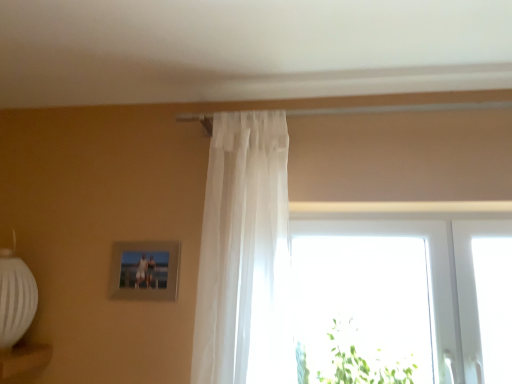
Question: Is sheer white curtain at center a part of metallic silver picture frame at upper left?

Choices:
 (A) yes
 (B) no

Answer: (B)

Question: Is metallic silver picture frame at upper left next to sheer white curtain at center?

Choices:
 (A) no
 (B) yes

Answer: (A)

Question: Does metallic silver picture frame at upper left appear on the left side of sheer white curtain at center?

Choices:
 (A) yes
 (B) no

Answer: (A)

Question: From the image's perspective, is metallic silver picture frame at upper left located beneath sheer white curtain at center?

Choices:
 (A) no
 (B) yes

Answer: (B)

Question: From the image's perspective, is metallic silver picture frame at upper left over sheer white curtain at center?

Choices:
 (A) no
 (B) yes

Answer: (A)

Question: Is transparent glass window at center taller or shorter than metallic silver picture frame at upper left?

Choices:
 (A) short
 (B) tall

Answer: (B)

Question: Does point (445, 238) appear closer or farther from the camera than point (163, 251)?

Choices:
 (A) farther
 (B) closer

Answer: (A)

Question: From the image's perspective, relative to metallic silver picture frame at upper left, is transparent glass window at center above or below?

Choices:
 (A) above
 (B) below

Answer: (B)

Question: Considering the positions of transparent glass window at center and metallic silver picture frame at upper left in the image, is transparent glass window at center wider or thinner than metallic silver picture frame at upper left?

Choices:
 (A) wide
 (B) thin

Answer: (A)

Question: Based on their positions, is green leafy plant at lower right located to the left or right of transparent glass window at center?

Choices:
 (A) right
 (B) left

Answer: (B)

Question: Does point (364, 345) appear closer or farther from the camera than point (312, 223)?

Choices:
 (A) farther
 (B) closer

Answer: (B)

Question: In the image, is green leafy plant at lower right positioned in front of or behind transparent glass window at center?

Choices:
 (A) behind
 (B) front

Answer: (B)

Question: Considering the positions of green leafy plant at lower right and transparent glass window at center in the image, is green leafy plant at lower right wider or thinner than transparent glass window at center?

Choices:
 (A) thin
 (B) wide

Answer: (B)

Question: From a real-world perspective, is metallic silver picture frame at upper left above or below transparent glass window at center?

Choices:
 (A) below
 (B) above

Answer: (B)

Question: Considering the positions of point (156, 271) and point (371, 231), is point (156, 271) closer or farther from the camera than point (371, 231)?

Choices:
 (A) closer
 (B) farther

Answer: (A)